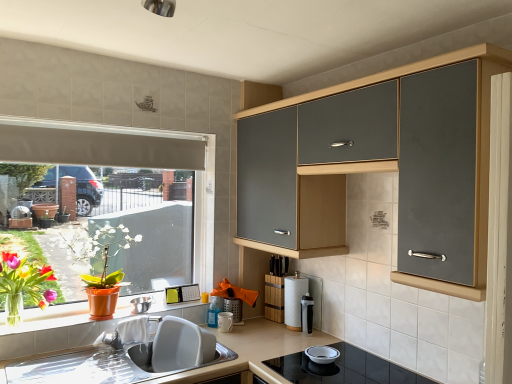
Find the location of `free location in front of white ceramic mug at lower center, placed as the 3th appliance when sorted from left to right`. free location in front of white ceramic mug at lower center, placed as the 3th appliance when sorted from left to right is located at coordinates (233, 346).